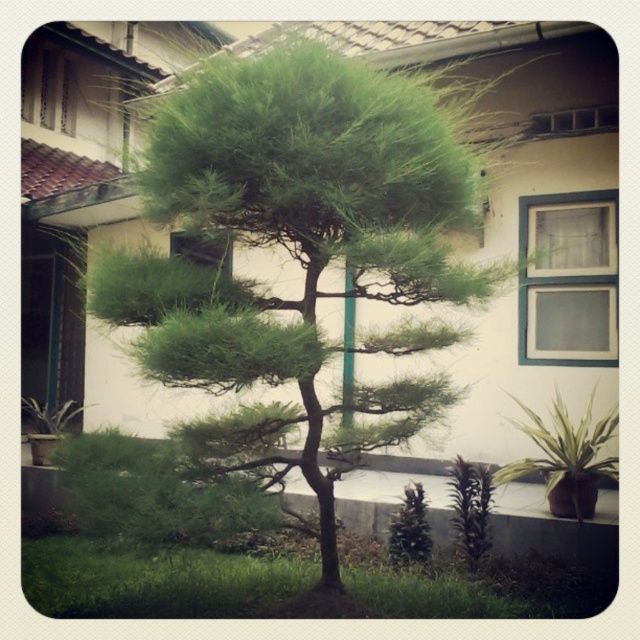
Does point (294, 150) come in front of point (460, 522)?

That is True.

Does green leafy tree at center appear under green matte pine at lower center?

No.

The image size is (640, 640). What are the coordinates of `green leafy tree at center` in the screenshot? It's located at (301, 248).

Who is shorter, green matte pine at lower center or green matte pine at center?

green matte pine at center is shorter.

Who is more forward, (465, 513) or (410, 545)?

Point (465, 513) is in front.

Identify the location of green matte pine at lower center. (470, 509).

Is green leafy plant at lower right above green matte pine at center?

Yes, green leafy plant at lower right is above green matte pine at center.

Is point (566, 412) positioned after point (406, 484)?

Yes, it is behind point (406, 484).

The height and width of the screenshot is (640, 640). I want to click on green leafy plant at lower right, so click(564, 456).